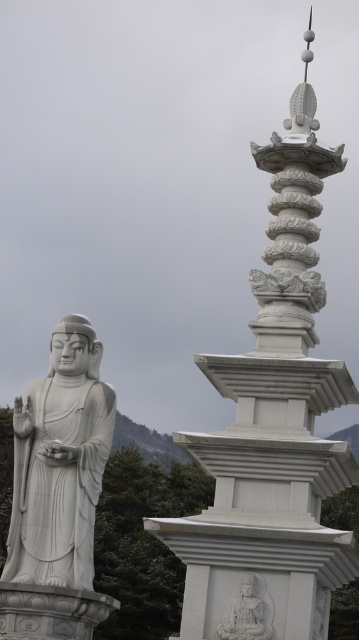
Which is more to the left, white marble statue at left or white stone statue at center?

From the viewer's perspective, white marble statue at left appears more on the left side.

Which is behind, point (92, 371) or point (260, 579)?

The point (92, 371) is behind.

Find the location of a particular element. This screenshot has width=359, height=640. white marble statue at left is located at coordinates (59, 461).

Locate an element on the screen. This screenshot has width=359, height=640. white marble statue at left is located at coordinates (59, 461).

Between white stone pagoda at upper center and white stone statue at center, which one has more height?

white stone pagoda at upper center

I want to click on white stone pagoda at upper center, so click(x=273, y=420).

Can you confirm if white stone pagoda at upper center is positioned to the left of white marble statue at left?

In fact, white stone pagoda at upper center is to the right of white marble statue at left.

What do you see at coordinates (273, 420) in the screenshot?
I see `white stone pagoda at upper center` at bounding box center [273, 420].

The height and width of the screenshot is (640, 359). I want to click on white stone pagoda at upper center, so click(x=273, y=420).